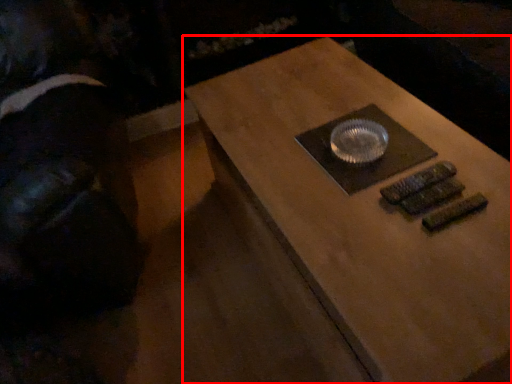
Question: Where is table (annotated by the red box) located in relation to person in the image?

Choices:
 (A) left
 (B) right

Answer: (B)